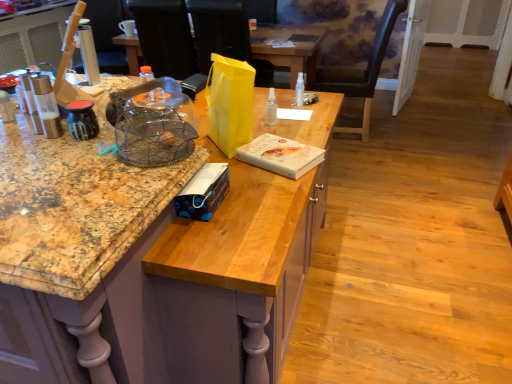
Identify the location of vacant area that is in front of wire mesh birdcage at center. (109, 200).